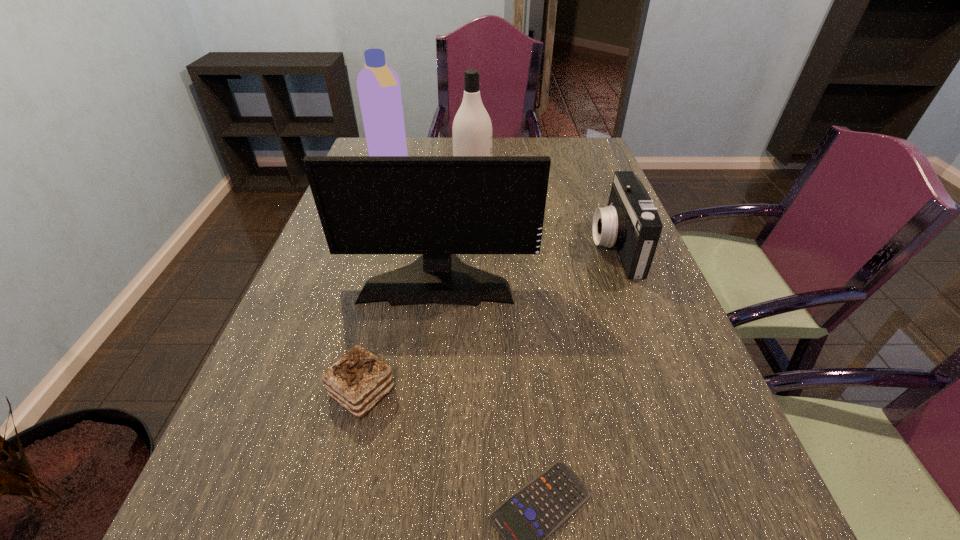
In order to click on the second farthest object in this screenshot , I will do `click(472, 131)`.

Where is `the nearer shampoo`? The width and height of the screenshot is (960, 540). the nearer shampoo is located at coordinates (472, 131).

You are a GUI agent. You are given a task and a screenshot of the screen. Output one action in this format:
    pyautogui.click(x=<x>, y=<y>)
    Task: Click on the left shampoo
    Image resolution: width=960 pixels, height=540 pixels.
    Given the screenshot: What is the action you would take?
    pyautogui.click(x=378, y=85)

Where is `the farthest object`? the farthest object is located at coordinates (378, 85).

Locate an element on the screen. This screenshot has height=540, width=960. monitor is located at coordinates (439, 206).

At what (x,y) coordinates should I click in order to perform the action: click on the third shortest object. Please return your answer as a coordinate pair (x, y). This screenshot has height=540, width=960. Looking at the image, I should click on (630, 223).

This screenshot has width=960, height=540. I want to click on camcorder, so click(630, 223).

Locate an element on the screen. the second nearest object is located at coordinates (358, 380).

Where is `the fifth tallest object`? the fifth tallest object is located at coordinates (358, 380).

Find the location of a particular element. This screenshot has width=960, height=540. vacant space located on the front-facing side of the nearer shampoo is located at coordinates (533, 190).